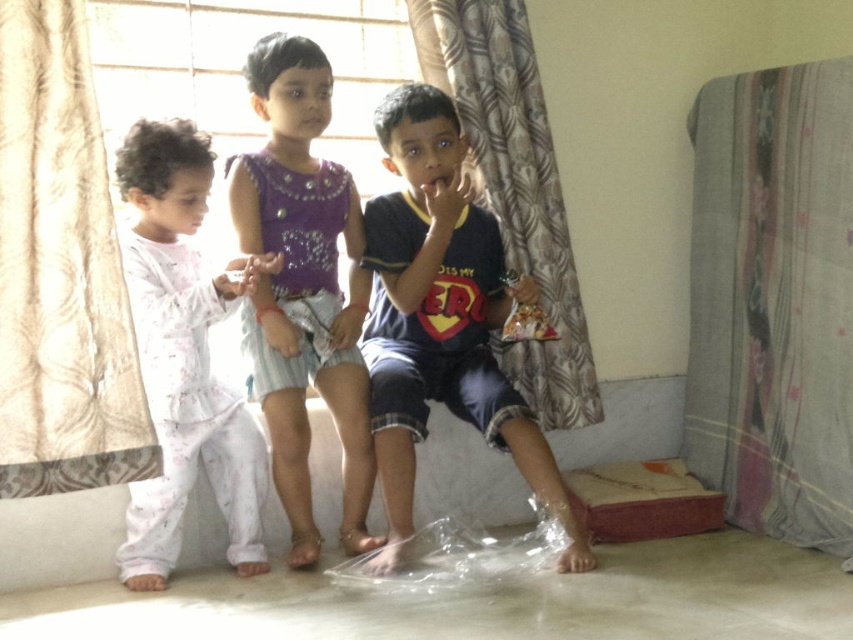
You are a photographer setting up a shoot in this room. You need to position a light source between the floral fabric curtain at right and the purple sequined dress at center. Based on their positions, where should you place the light source?

The light source should be placed between the floral fabric curtain at right and the purple sequined dress at center, closer to the purple sequined dress at center since the curtain is to its right.

You are a photographer trying to capture a group photo of the children. Since the dark blue jersey at center and the light pink cotton pajamas at left are different in height, which child should you ask to sit on a small stool to ensure they are at the same eye level?

The light pink cotton pajamas at left should sit on a small stool because the dark blue jersey at center is much taller, so raising the shorter child would balance their heights.